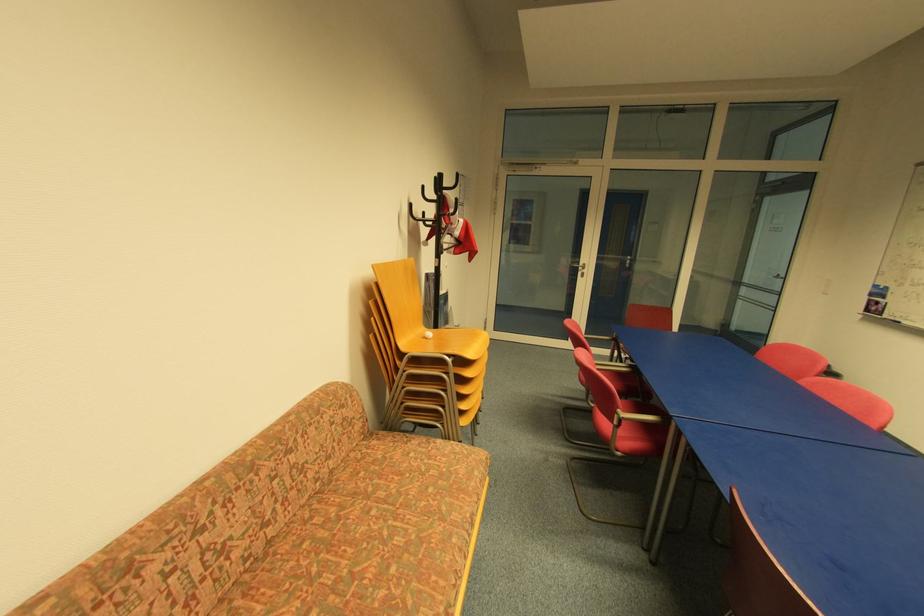
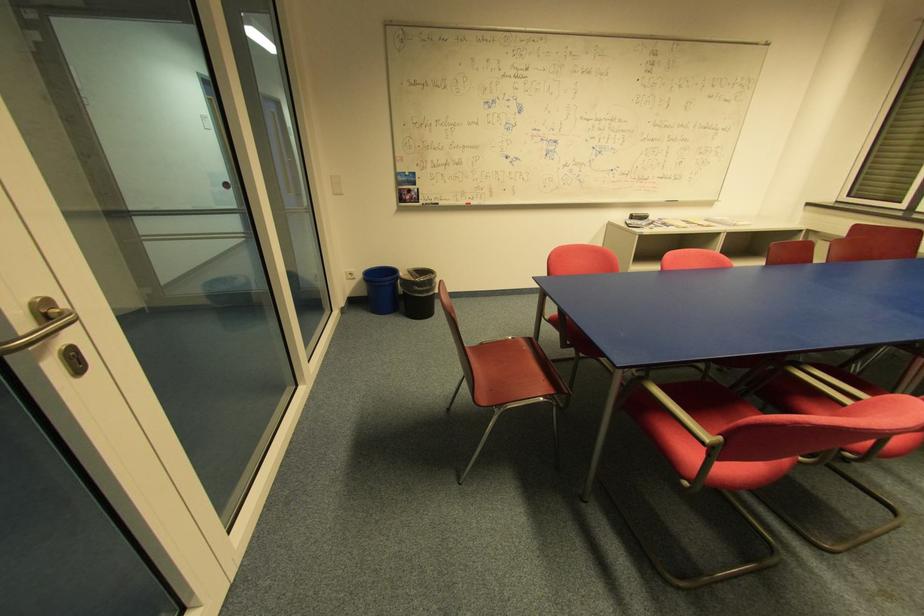
Locate, in the second image, the point that corresponds to point (589, 265) in the first image.

(51, 304)